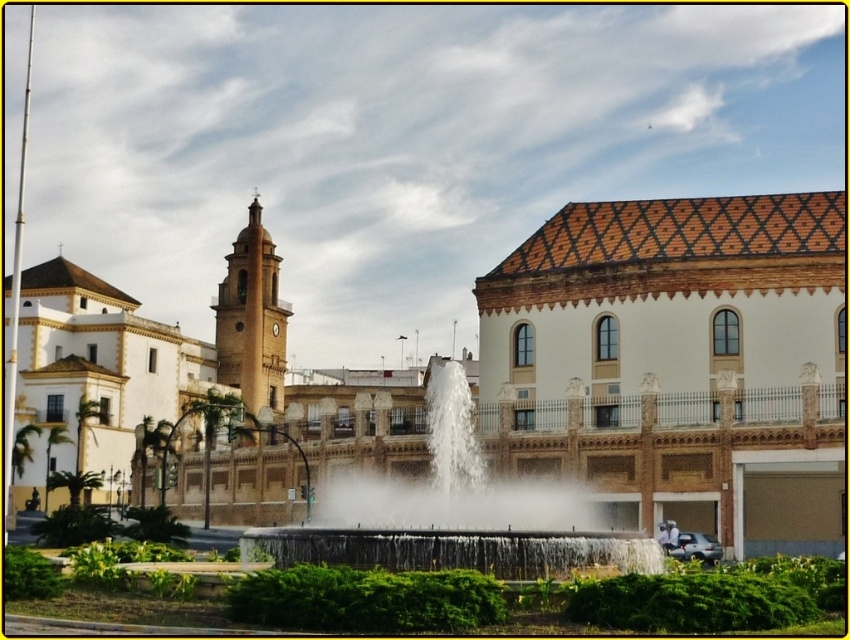
Find the location of `white textured fountain at center`. white textured fountain at center is located at coordinates (677, 362).

Does white textured fountain at center lie behind terracotta tiled palace at right?

Yes, white textured fountain at center is further from the viewer.

Who is more forward, (x=831, y=307) or (x=808, y=497)?

Point (x=808, y=497)

You are a GUI agent. You are given a task and a screenshot of the screen. Output one action in this format:
    pyautogui.click(x=<x>, y=<y>)
    Task: Click on the white textured fountain at center
    Image resolution: width=850 pixels, height=640 pixels.
    Given the screenshot: What is the action you would take?
    pyautogui.click(x=677, y=362)

Who is higher up, terracotta tiled palace at right or white stone fountain at center?

Positioned higher is terracotta tiled palace at right.

Locate an element on the screen. terracotta tiled palace at right is located at coordinates (681, 360).

What are the coordinates of `terracotta tiled palace at right` in the screenshot? It's located at point(681,360).